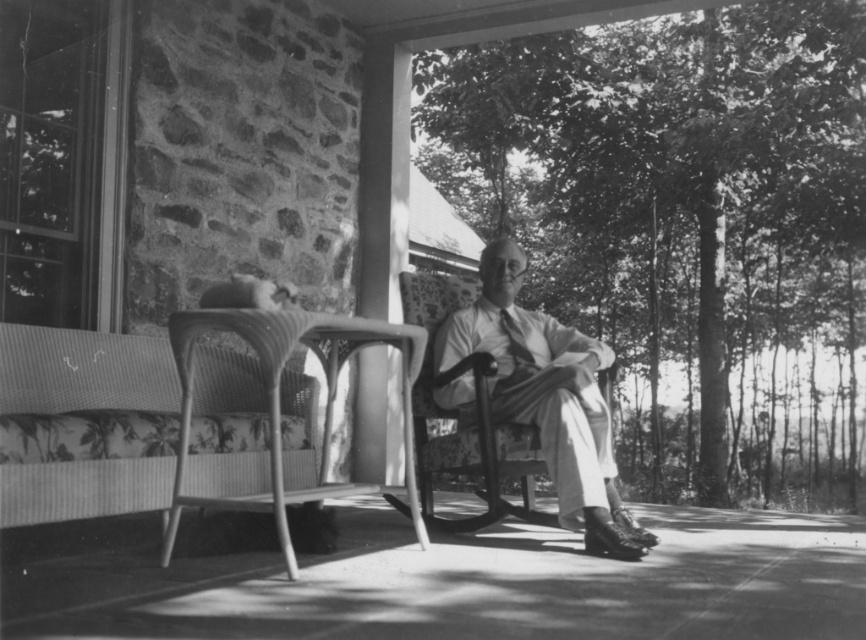
Who is positioned more to the right, woven fabric park bench at lower left or light beige fabric chair at center?

Positioned to the right is light beige fabric chair at center.

The width and height of the screenshot is (866, 640). Find the location of `woven fabric park bench at lower left`. woven fabric park bench at lower left is located at coordinates (83, 424).

You are a GUI agent. You are given a task and a screenshot of the screen. Output one action in this format:
    pyautogui.click(x=<x>, y=<y>)
    Task: Click on the woven fabric park bench at lower left
    This screenshot has width=866, height=640.
    Given the screenshot: What is the action you would take?
    pyautogui.click(x=83, y=424)